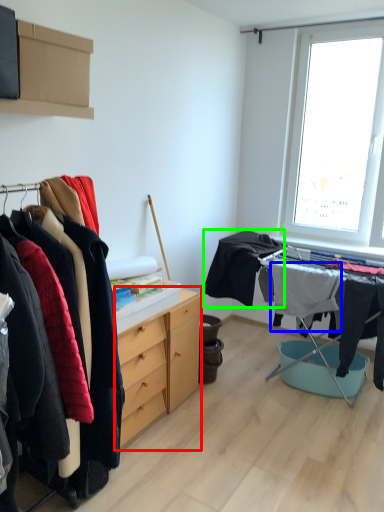
Question: Which object is positioned closest to chest of drawers (highlighted by a red box)? Select from clothing (highlighted by a blue box) and clothing (highlighted by a green box).

Choices:
 (A) clothing
 (B) clothing

Answer: (B)